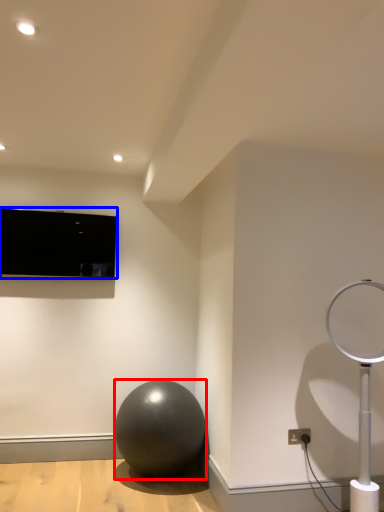
Question: Which object is closer to the camera taking this photo, ball (highlighted by a red box) or television (highlighted by a blue box)?

Choices:
 (A) ball
 (B) television

Answer: (A)